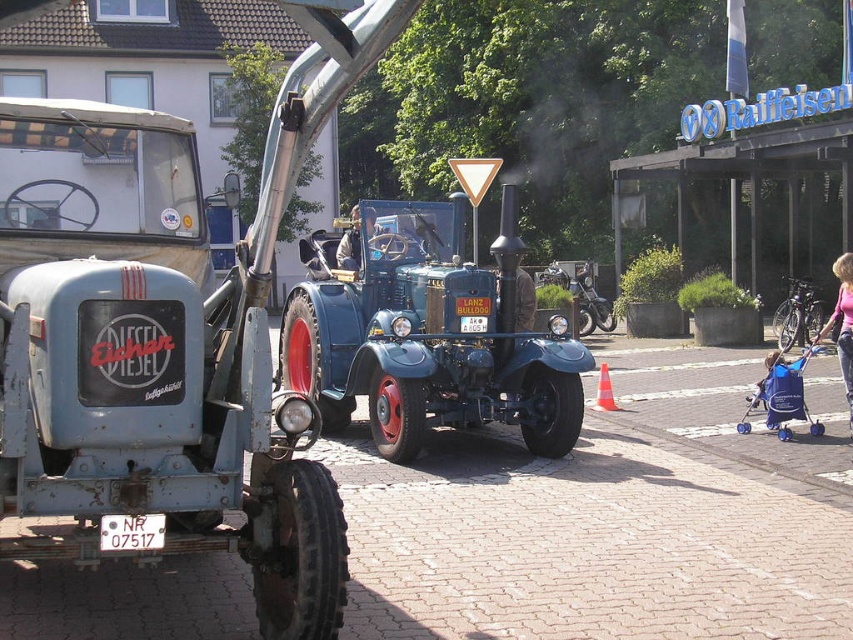
In the scene shown: You are standing at the center of the image and see a point marked at coordinates (184,385). What object is located at that point?

The point at coordinates (184,385) is occupied by the matte blue tow truck at left.

You are a photographer standing at the event. You want to capture a photo of the matte blue tow truck at left without any obstructions. Given that the minimum focusing distance of your camera is 3 meters, can you take the photo clearly?

The matte blue tow truck at left is 3.30 meters away from the camera, which is beyond the minimum focusing distance of 3 meters. Therefore, you can take the photo clearly without any issues.